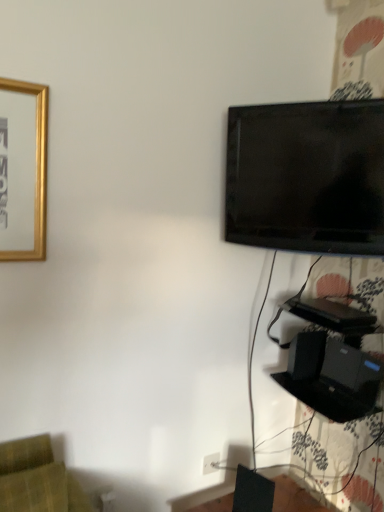
Question: From the image's perspective, relative to black matte speaker at lower right, the 1th speaker viewed from the right, is white plastic electric outlet at lower center above or below?

Choices:
 (A) above
 (B) below

Answer: (B)

Question: In terms of size, does white plastic electric outlet at lower center appear bigger or smaller than black matte speaker at lower right, acting as the 2th speaker starting from the front?

Choices:
 (A) small
 (B) big

Answer: (A)

Question: Which is farther from the black glossy tv at upper right?

Choices:
 (A) black matte speaker at lower right, which is the first speaker from top to bottom
 (B) black matte speaker at lower right, marked as the second speaker in a right-to-left arrangement
 (C) white plastic electric outlet at lower center

Answer: (C)

Question: Estimate the real-world distances between objects in this image. Which object is closer to the black glossy tv at upper right?

Choices:
 (A) white plastic electric outlet at lower center
 (B) black matte speaker at lower right, which is the 2th speaker from bottom to top
 (C) black matte speaker at lower right, which ranks as the first speaker in front-to-back order

Answer: (B)